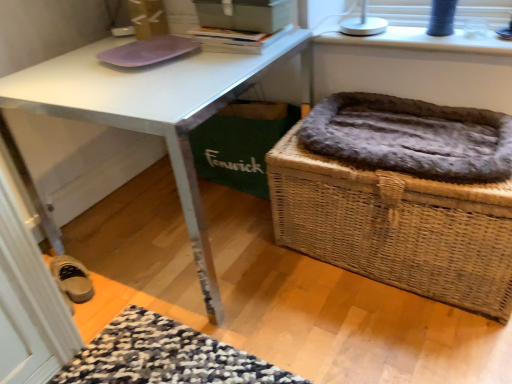
Question: Should I look upward or downward to see white plastic lamp at upper right?

Choices:
 (A) down
 (B) up

Answer: (B)

Question: Can we say fur-lined wicker basket at right lies outside hardcover book at upper center?

Choices:
 (A) yes
 (B) no

Answer: (A)

Question: Considering the relative positions of fur-lined wicker basket at right and hardcover book at upper center in the image provided, is fur-lined wicker basket at right to the left of hardcover book at upper center from the viewer's perspective?

Choices:
 (A) no
 (B) yes

Answer: (A)

Question: Considering the relative sizes of fur-lined wicker basket at right and hardcover book at upper center in the image provided, is fur-lined wicker basket at right smaller than hardcover book at upper center?

Choices:
 (A) no
 (B) yes

Answer: (A)

Question: Can you see fur-lined wicker basket at right touching hardcover book at upper center?

Choices:
 (A) yes
 (B) no

Answer: (B)

Question: Can you confirm if fur-lined wicker basket at right is wider than hardcover book at upper center?

Choices:
 (A) no
 (B) yes

Answer: (B)

Question: From a real-world perspective, is fur-lined wicker basket at right physically above hardcover book at upper center?

Choices:
 (A) yes
 (B) no

Answer: (B)

Question: Can you confirm if white plastic lamp at upper right is wider than purple matte mousepad at upper left?

Choices:
 (A) yes
 (B) no

Answer: (B)

Question: Is white plastic lamp at upper right in contact with purple matte mousepad at upper left?

Choices:
 (A) yes
 (B) no

Answer: (B)

Question: From a real-world perspective, is white plastic lamp at upper right on top of purple matte mousepad at upper left?

Choices:
 (A) yes
 (B) no

Answer: (B)

Question: From a real-world perspective, is white plastic lamp at upper right physically below purple matte mousepad at upper left?

Choices:
 (A) yes
 (B) no

Answer: (A)

Question: Can you confirm if white plastic lamp at upper right is positioned to the left of purple matte mousepad at upper left?

Choices:
 (A) no
 (B) yes

Answer: (A)

Question: Can you confirm if white plastic lamp at upper right is shorter than purple matte mousepad at upper left?

Choices:
 (A) yes
 (B) no

Answer: (B)

Question: From a real-world perspective, is white plastic lamp at upper right on top of white glossy desk at center?

Choices:
 (A) yes
 (B) no

Answer: (A)